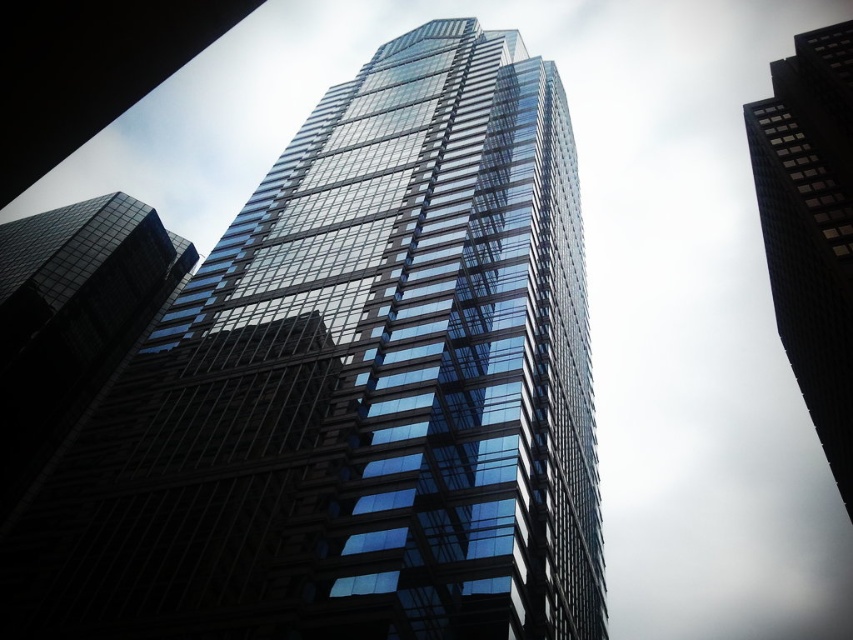
You are an architect analyzing the image of a city skyline. You notice two glass buildings in the scene. Based on their sizes, which one would require more materials to construct? Please refer to the transparent glass building at center and the black glass skyscraper at upper right in your answer.

The transparent glass building at center requires more materials to construct because it is larger in size than the black glass skyscraper at upper right.

You are standing in the city park and see the transparent glass building at center and the black glass skyscraper at upper right. Which one is positioned to the left when viewed from your perspective?

The transparent glass building at center is positioned to the left of the black glass skyscraper at upper right.

You are an architect analyzing the layout of the city skyline. You notice the transparent glass building at center and the black glass skyscraper at upper right. Which of these two buildings is positioned higher in the image?

The transparent glass building at center is positioned higher in the image than the black glass skyscraper at upper right according to the description.